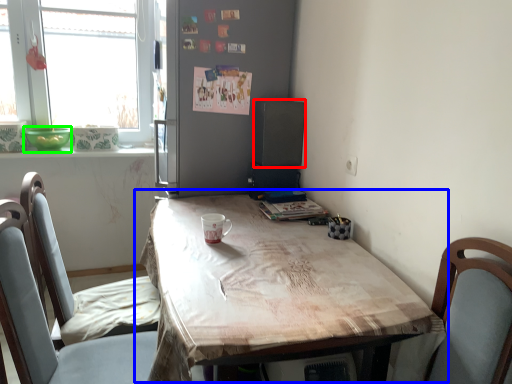
Question: Which object is the closest to the loudspeaker (highlighted by a red box)? Choose among these: table (highlighted by a blue box) or glass bowl (highlighted by a green box).

Choices:
 (A) table
 (B) glass bowl

Answer: (A)